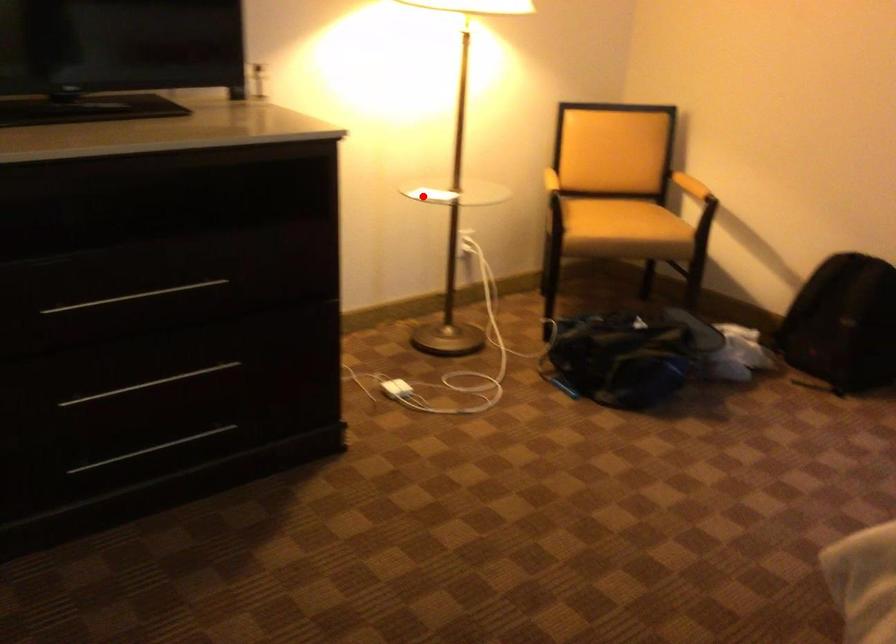
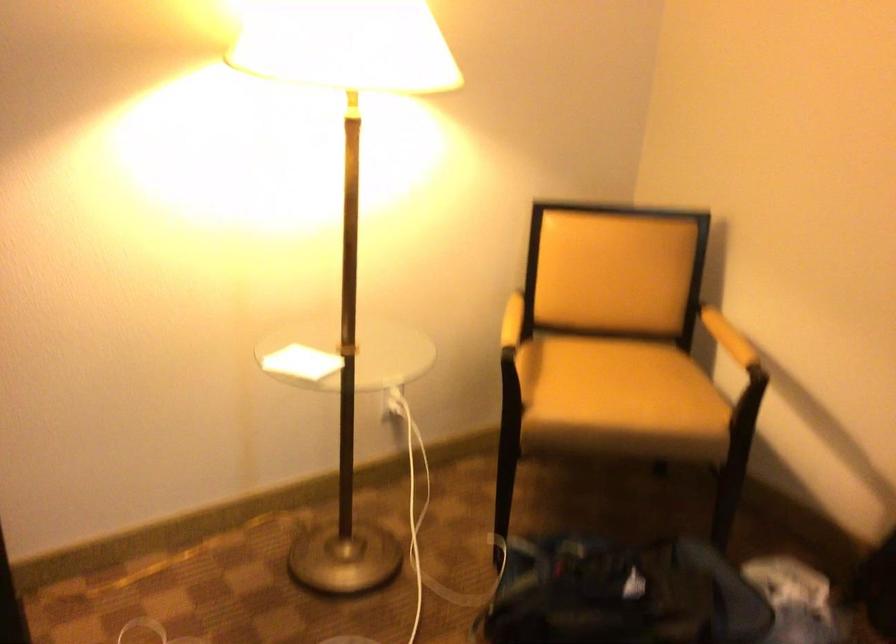
Question: I am providing you with two images of the same scene from different viewpoints. A red point is shown in image1. For the corresponding object point in image2, is it positioned nearer or farther from the camera?

Choices:
 (A) Nearer
 (B) Farther

Answer: (A)